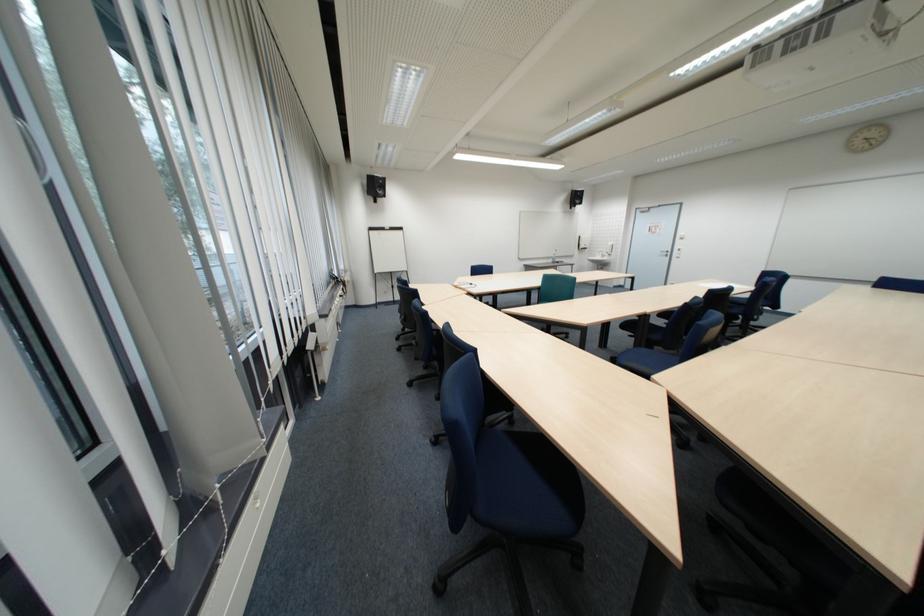
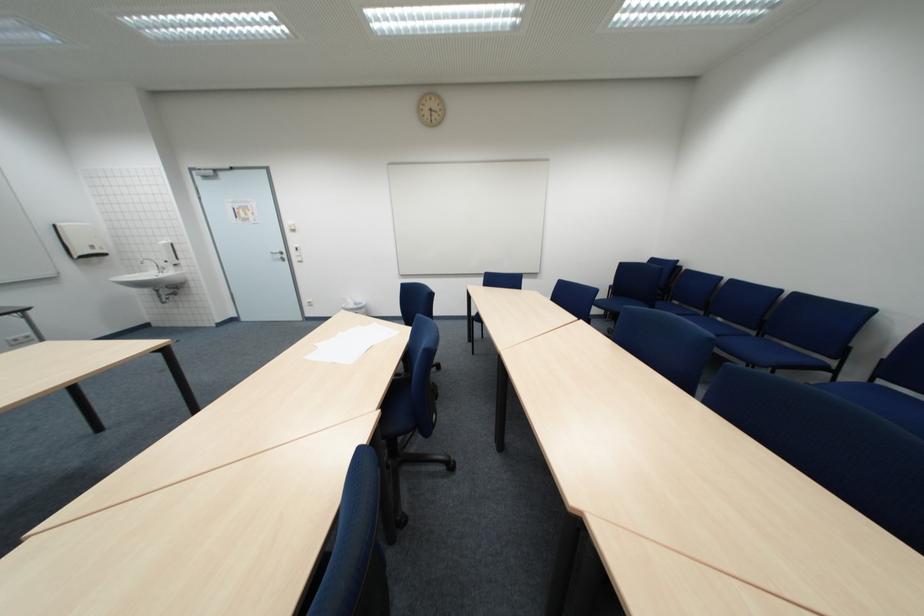
Locate, in the second image, the point that corresponds to pixel 683 254 in the first image.

(299, 257)